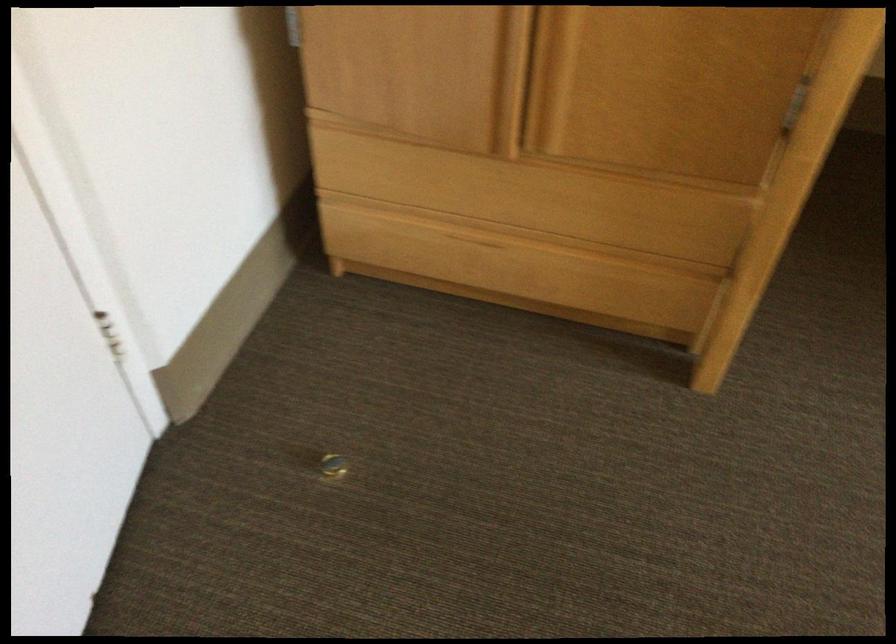
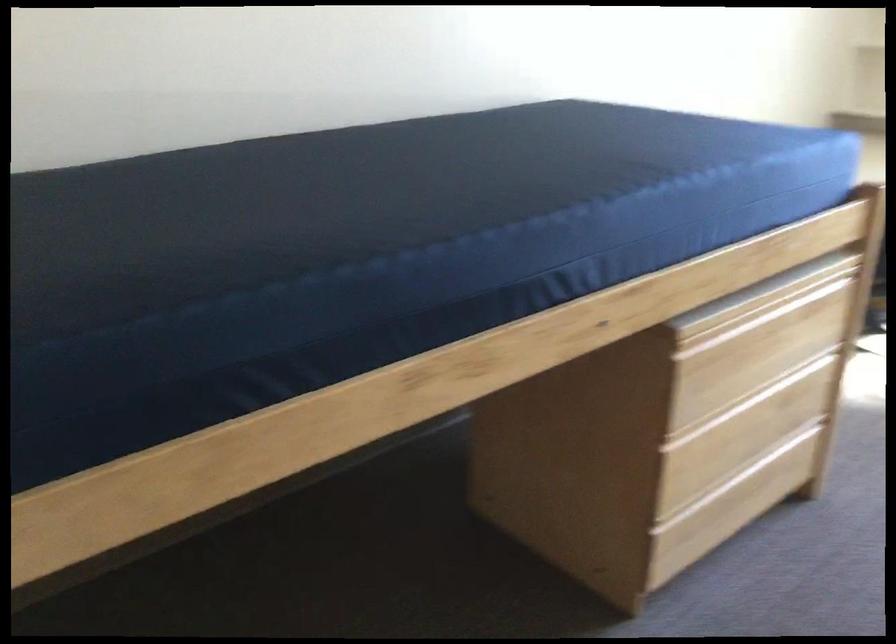
Question: The first image is from the beginning of the video and the second image is from the end. How did the camera likely rotate when shooting the video?

Choices:
 (A) Left
 (B) Right
 (C) Up
 (D) Down

Answer: (B)